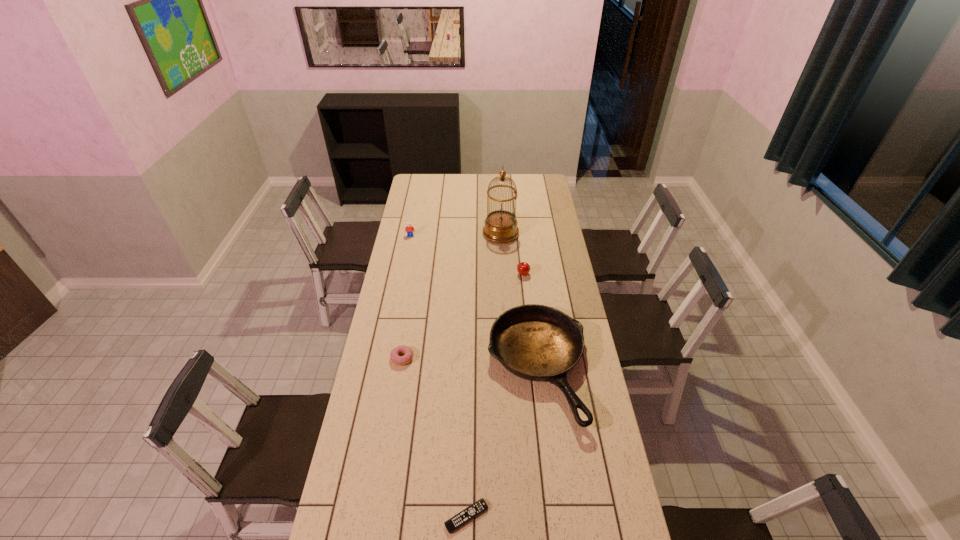
Where is `vacant point at the right edge`? The height and width of the screenshot is (540, 960). vacant point at the right edge is located at coordinates (533, 212).

Identify the location of free point at the far left corner. (421, 177).

Identify the location of free area in between the fifth tallest object and the tallest object. (451, 295).

Where is `free point between the shortest object and the doughnut`? Image resolution: width=960 pixels, height=540 pixels. free point between the shortest object and the doughnut is located at coordinates (434, 437).

The width and height of the screenshot is (960, 540). What are the coordinates of `free space between the remote control and the frying pan` in the screenshot? It's located at (502, 442).

At what (x,y) coordinates should I click in order to perform the action: click on vacant area that lies between the frying pan and the fifth tallest object. Please return your answer as a coordinate pair (x, y). Looking at the image, I should click on (469, 363).

Where is `free spot between the frying pan and the birdcage`? This screenshot has height=540, width=960. free spot between the frying pan and the birdcage is located at coordinates (519, 301).

In order to click on empty location between the third farthest object and the birdcage in this screenshot , I will do `click(512, 254)`.

Where is `free spot between the remote control and the frying pan`? free spot between the remote control and the frying pan is located at coordinates (502, 442).

You are a GUI agent. You are given a task and a screenshot of the screen. Output one action in this format:
    pyautogui.click(x=<x>, y=<y>)
    Task: Click on the vacant space that is in between the birdcage and the Lego
    Image resolution: width=960 pixels, height=540 pixels.
    Given the screenshot: What is the action you would take?
    pyautogui.click(x=455, y=234)